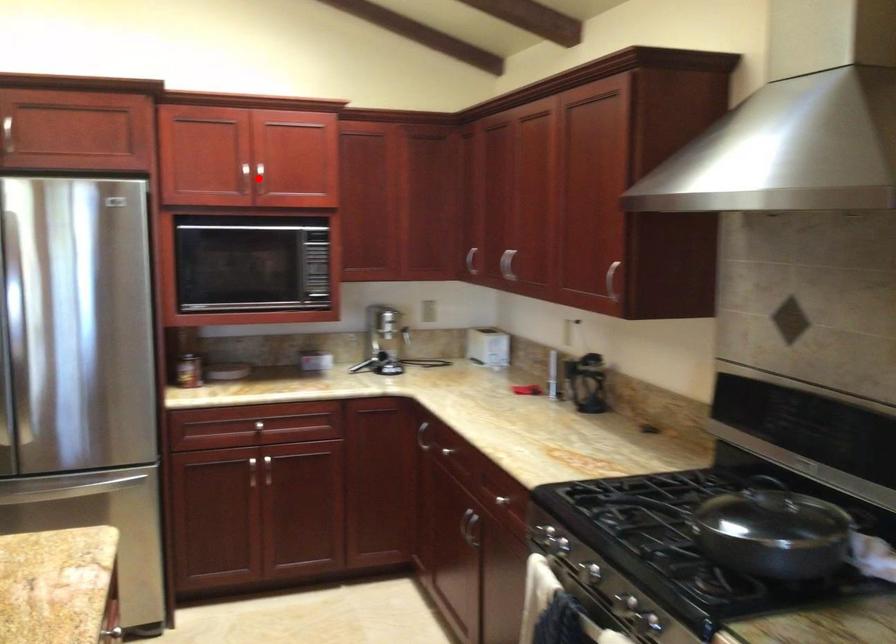
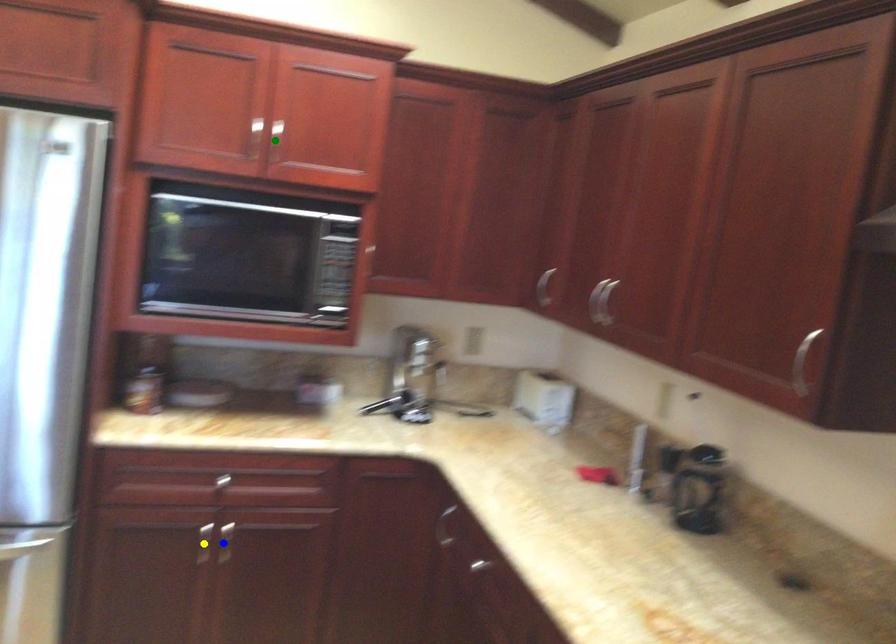
Question: I am providing you with two images of the same scene from different viewpoints. A red point is marked on the first image. You are given multiple points on the second image. Which mark in image 2 goes with the point in image 1?

Choices:
 (A) blue point
 (B) green point
 (C) yellow point

Answer: (B)